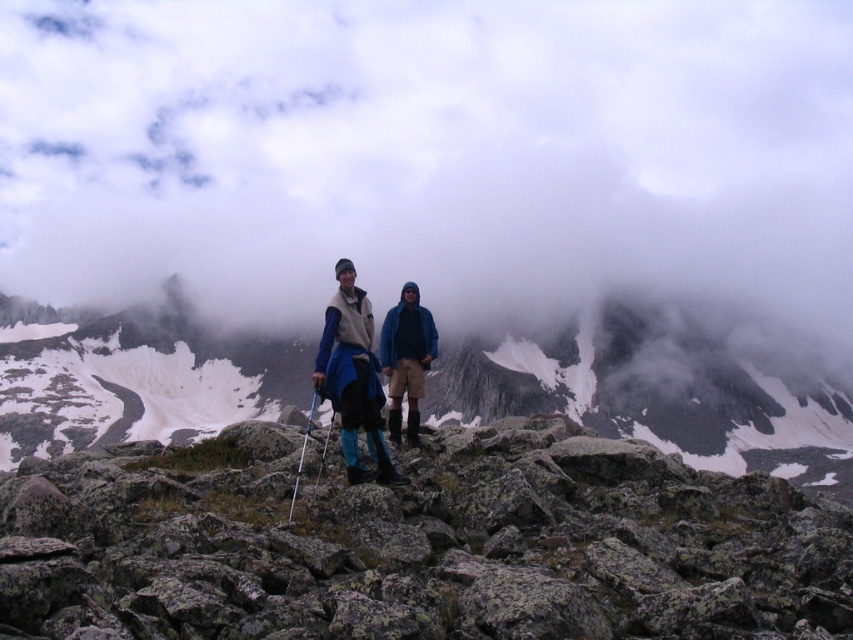
The image size is (853, 640). Find the location of `gray rock at center`. gray rock at center is located at coordinates (419, 545).

Which of these two, gray rock at center or rocky mountain at center, stands taller?

With more height is rocky mountain at center.

At what (x,y) coordinates should I click in order to perform the action: click on gray rock at center. Please return your answer as a coordinate pair (x, y). Looking at the image, I should click on (419, 545).

Who is more distant from viewer, [96,28] or [398,396]?

Point [96,28]

I want to click on white fluffy cloud at upper center, so click(x=436, y=156).

Is point (286, 371) behind point (376, 449)?

Yes, point (286, 371) is farther from viewer.

Which is behind, point (560, 337) or point (328, 396)?

The point (560, 337) is more distant.

Does point (573, 340) lie in front of point (383, 465)?

No.

Where is `rocky mountain at center`? The image size is (853, 640). rocky mountain at center is located at coordinates (654, 397).